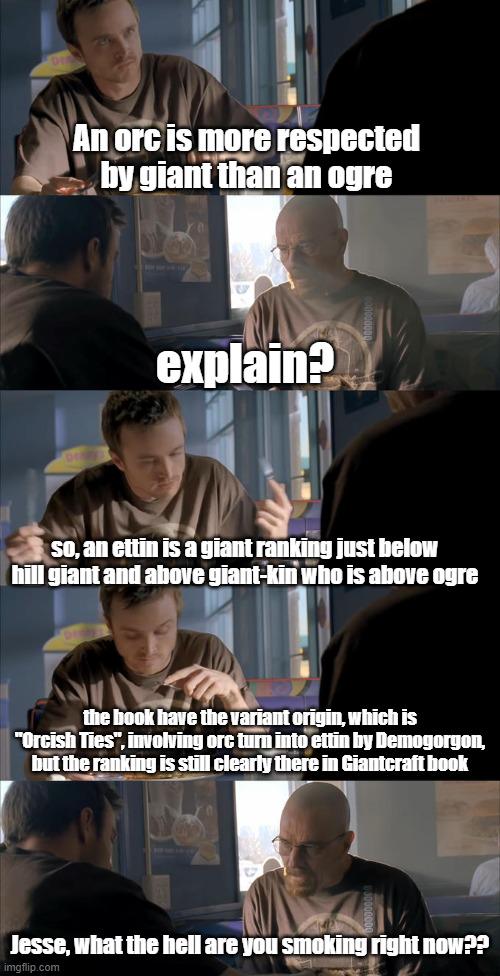
At what (x,y) coordinates should I click in order to perform the action: click on socket. Please return your answer as a coordinate pair (x, y). Looking at the image, I should click on (156, 888), (148, 306).